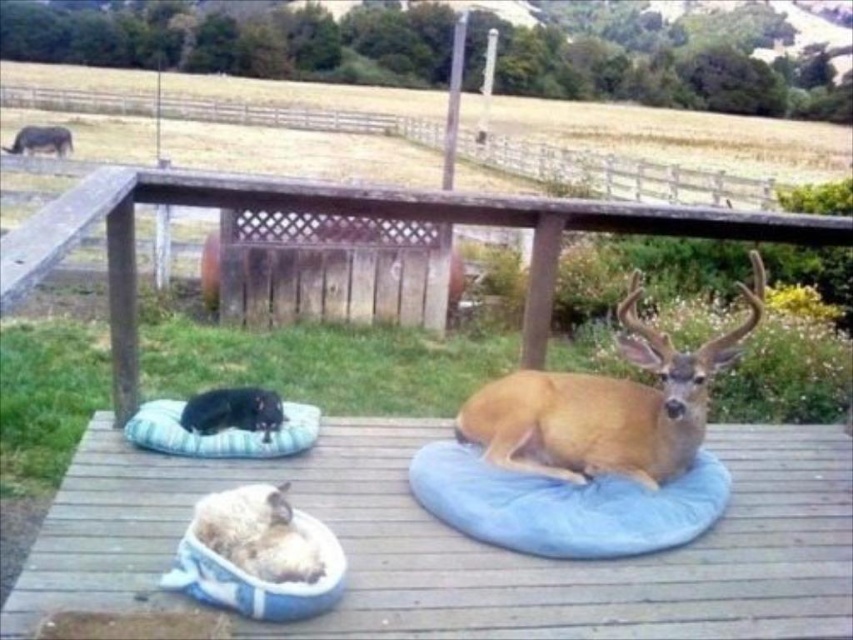
You are planning to place a new small garden bench on the wooden deck at center. Considering the size of the blue plush dog bed at center, will there be enough space for the bench?

The wooden deck at center is bigger than the blue plush dog bed at center, so there should be enough space to place the new small garden bench on the wooden deck at center.

You are a small cat trying to reach the fluffy white dog bed at lower center from the blue plush dog bed at center. Which direction should you move to get there?

The blue plush dog bed at center is closer to you than the fluffy white dog bed at lower center, so you need to move forward to reach the fluffy white dog bed at lower center.

You are standing in front of a wooden deck with a blue plush dog bed at center. If you want to reach the bed without stepping on the deck planks, can you stretch your hand to it?

The blue plush dog bed at center is 2.46 meters away from camera. Since the average human arm length is about 0.7 meters, you cannot reach it without moving closer.